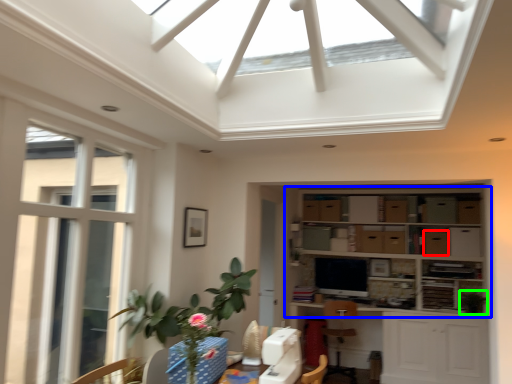
Question: Which object is positioned farthest from cabinetry (highlighted by a red box)? Select from shelf (highlighted by a blue box) and plant (highlighted by a green box).

Choices:
 (A) shelf
 (B) plant

Answer: (B)